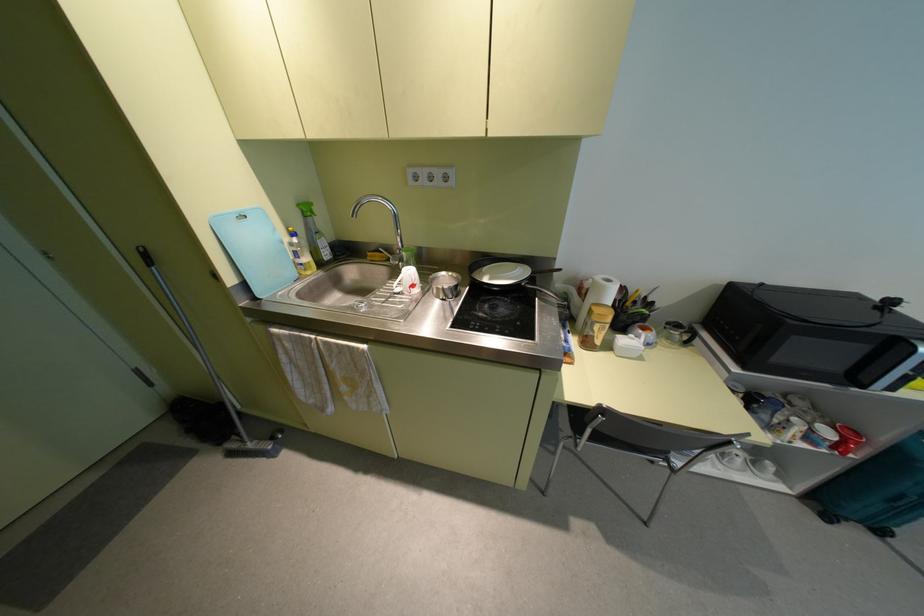
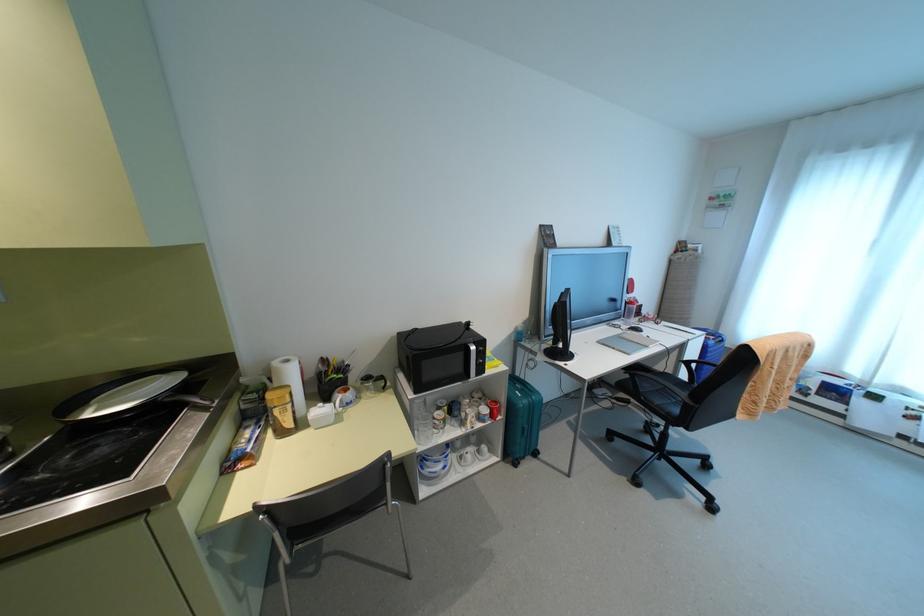
Find the pixel in the second image that matches pixel 686 342 in the first image.

(383, 387)